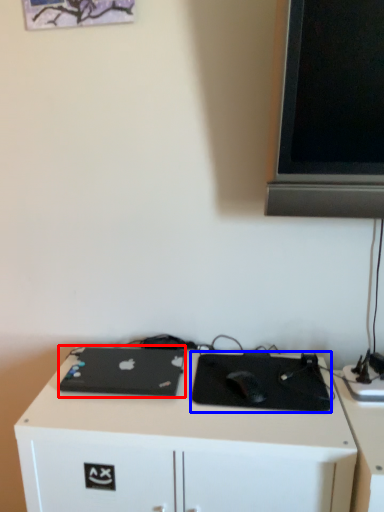
Question: Which object appears farthest to the camera in this image, laptop (highlighted by a red box) or mousepad (highlighted by a blue box)?

Choices:
 (A) laptop
 (B) mousepad

Answer: (A)